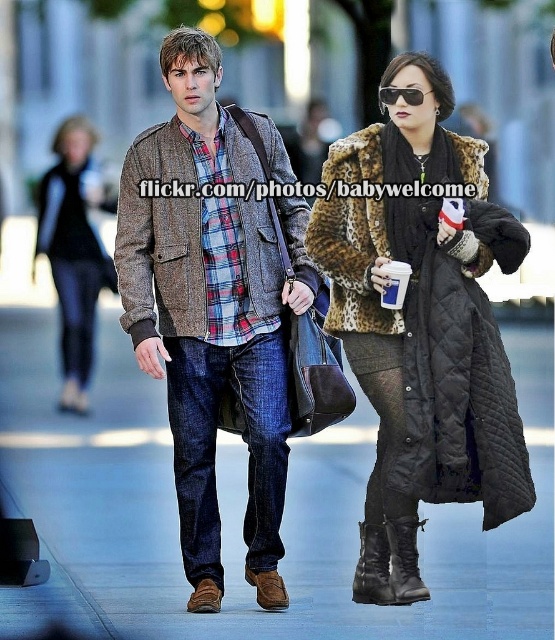
You are a fashion designer observing two people in an urban setting. You notice the dark blue denim jeans at center and the leopard fur coat at upper right. Which clothing item is positioned higher in the image?

The dark blue denim jeans at center is much taller than the leopard fur coat at upper right, so the dark blue denim jeans at center is positioned higher in the image.

Consider the image. What are the coordinates of the dark blue denim jeans at center?

The coordinates of the dark blue denim jeans at center are at point (214,445).